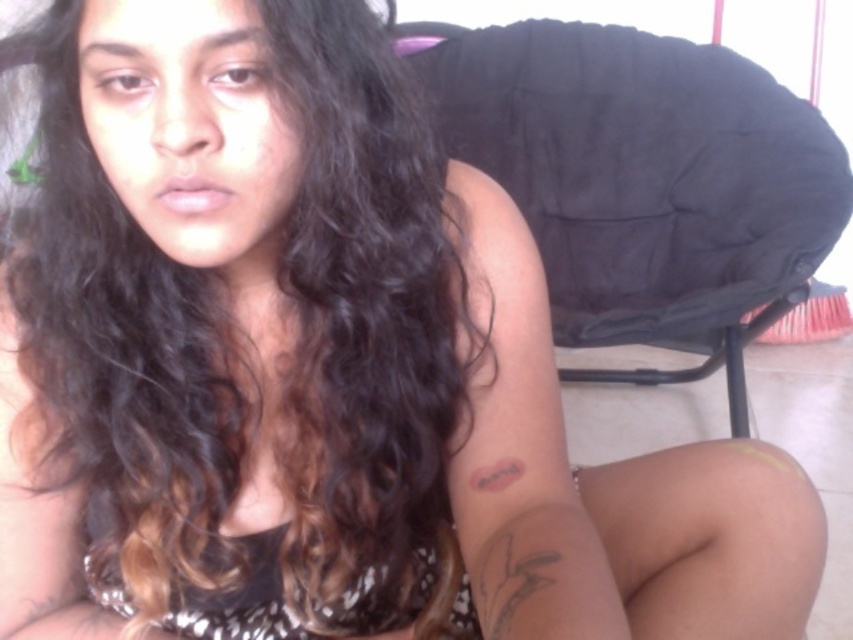
In the scene shown: You are trying to decide if the black fabric chair at upper right can fit through a doorway that is the same width as the black ink tattoo at upper arm. Based on their widths, can the chair fit through the doorway?

The black fabric chair at upper right might be wider than black ink tattoo at upper arm, so it may not fit through the doorway if the doorway is the same width as the tattoo.